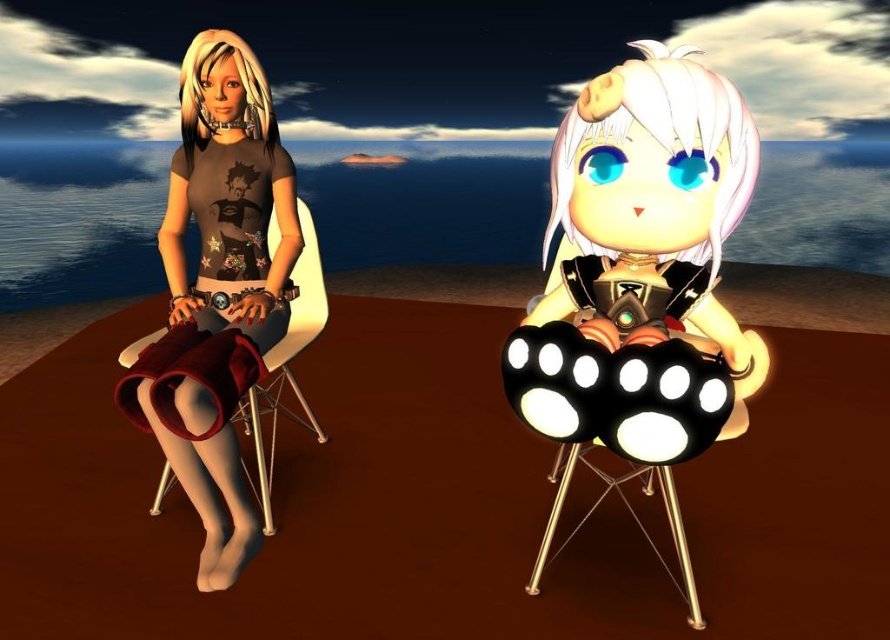
You are a character in the scene and want to place a small gift exactly where the shiny black paw pads at center are located. What are the coordinates where you should place the gift?

The coordinates for the shiny black paw pads at center are at point (654, 244). You should place the gift at those coordinates.

You are standing 5 feet away from the image. Is the point at coordinate point (718, 97) closer to you than the edge of the image?

The distance of point (718, 97) from viewer is 4.25 feet, so since you are standing 5 feet away from the image, the point is closer to you than the edge of the image.

You are a photographer setting up a shoot for these two characters. You need to position a small lamp between the shiny black paw pads at center and the metallic gold stool at right. Based on their positions, where should the lamp be placed?

The lamp should be placed between the shiny black paw pads at center and the metallic gold stool at right, as the shiny black paw pads at center is to the left of the metallic gold stool at right.